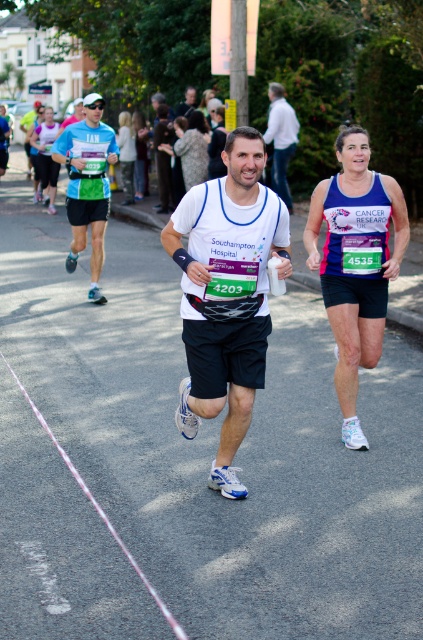
Question: Is matte purple tank top at right below white matte shirt at center?

Choices:
 (A) no
 (B) yes

Answer: (B)

Question: Does matte purple tank top at right have a larger size compared to matte black shirt at center?

Choices:
 (A) no
 (B) yes

Answer: (A)

Question: Which object appears closest to the camera in this image?

Choices:
 (A) matte blue shorts at left
 (B) matte black shirt at center
 (C) white matte shirt at center
 (D) matte purple tank top at right

Answer: (D)

Question: Which point is farther to the camera?

Choices:
 (A) (357, 304)
 (B) (191, 88)

Answer: (B)

Question: Which of the following is the farthest from the observer?

Choices:
 (A) (379, 256)
 (B) (290, 128)

Answer: (B)

Question: Does white matte running shirt at center appear under matte blue shorts at left?

Choices:
 (A) yes
 (B) no

Answer: (A)